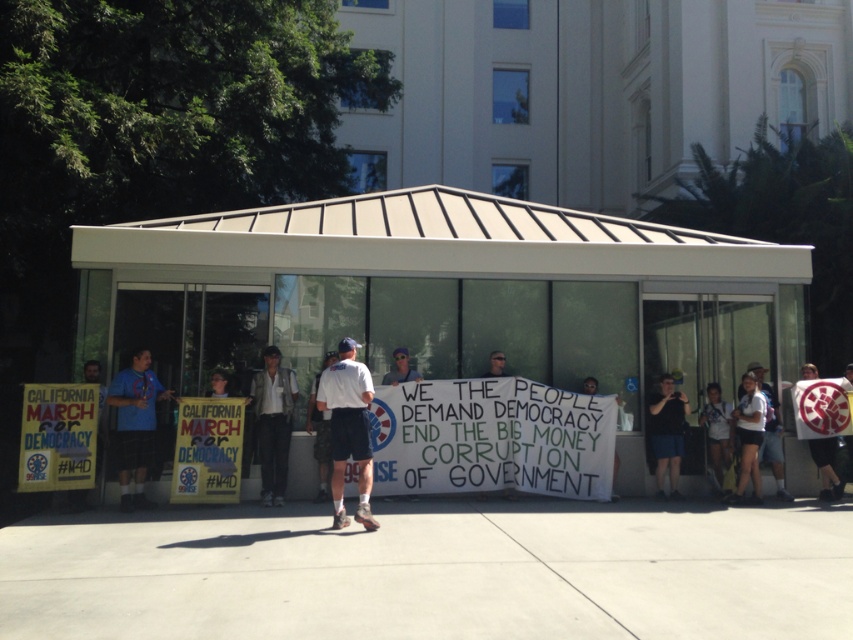
Does blue t-shirt at left have a lesser width compared to matte white sign at center?

Incorrect, blue t-shirt at left's width is not less than matte white sign at center's.

Who is higher up, blue t-shirt at left or matte white sign at center?

matte white sign at center is higher up.

Is point (125, 445) farther from viewer compared to point (384, 378)?

No, it is not.

Locate an element on the screen. blue t-shirt at left is located at coordinates (135, 424).

Is black fabric shorts at lower right to the left of white fabric shirt at lower right from the viewer's perspective?

Correct, you'll find black fabric shorts at lower right to the left of white fabric shirt at lower right.

Does point (677, 442) come behind point (718, 476)?

That is False.

Identify the location of black fabric shorts at lower right. [666, 432].

Can you confirm if white metal bus stop at center is shorter than blue t-shirt at left?

Incorrect, white metal bus stop at center's height does not fall short of blue t-shirt at left's.

Can you confirm if white metal bus stop at center is taller than blue t-shirt at left?

Yes.

Image resolution: width=853 pixels, height=640 pixels. What do you see at coordinates (448, 296) in the screenshot?
I see `white metal bus stop at center` at bounding box center [448, 296].

The width and height of the screenshot is (853, 640). What are the coordinates of `white metal bus stop at center` in the screenshot? It's located at (448, 296).